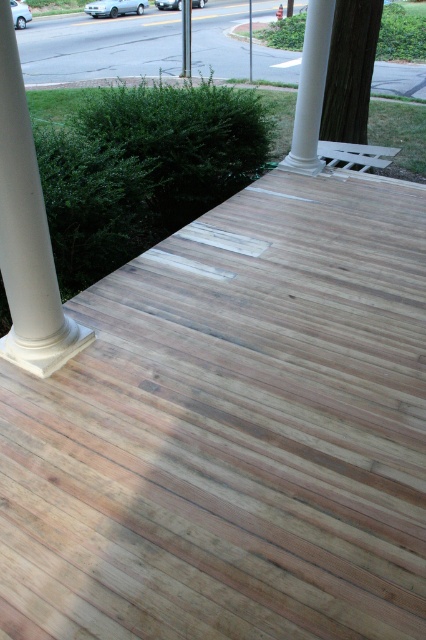
You are a painter who needs to decide which column to paint first. Since you want to start with the wider column, which one should you choose between the white smooth column at left and the white smooth column at upper center?

The white smooth column at left is wider than the white smooth column at upper center, so you should paint the white smooth column at left first.